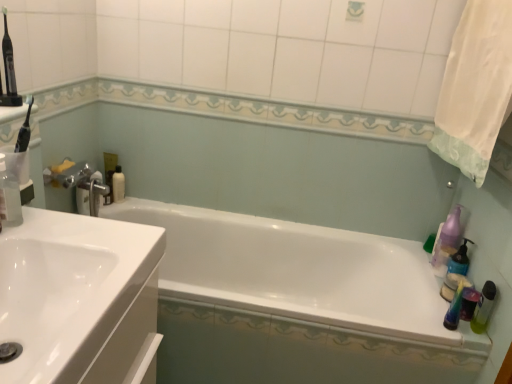
What are the coordinates of `vacant area that is situated to the right of white glossy bottle at upper left, the 1th mouthwash from the left` in the screenshot? It's located at (145, 202).